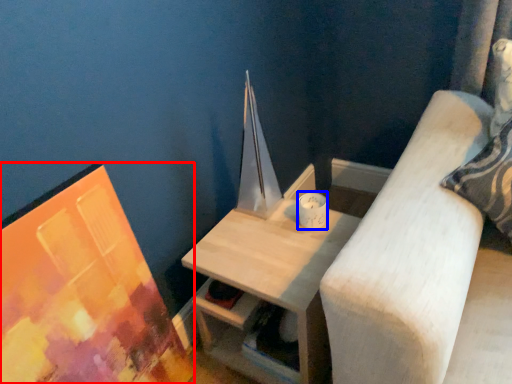
Question: Which object appears farthest to the camera in this image, picture frame (highlighted by a red box) or candle holder (highlighted by a blue box)?

Choices:
 (A) picture frame
 (B) candle holder

Answer: (B)